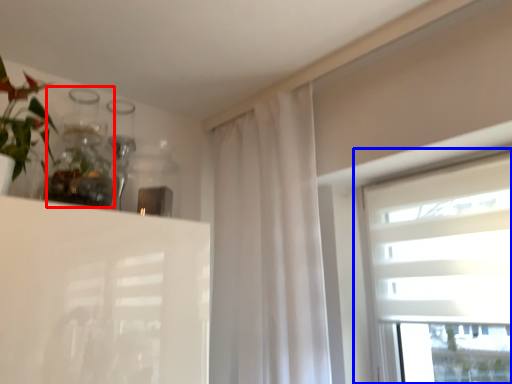
Question: Which object is closer to the camera taking this photo, glass vase (highlighted by a red box) or window (highlighted by a blue box)?

Choices:
 (A) glass vase
 (B) window

Answer: (A)